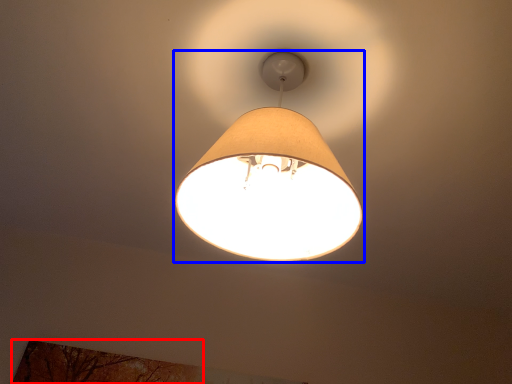
Question: Which object appears closest to the camera in this image, tree (highlighted by a red box) or lamp (highlighted by a blue box)?

Choices:
 (A) tree
 (B) lamp

Answer: (B)